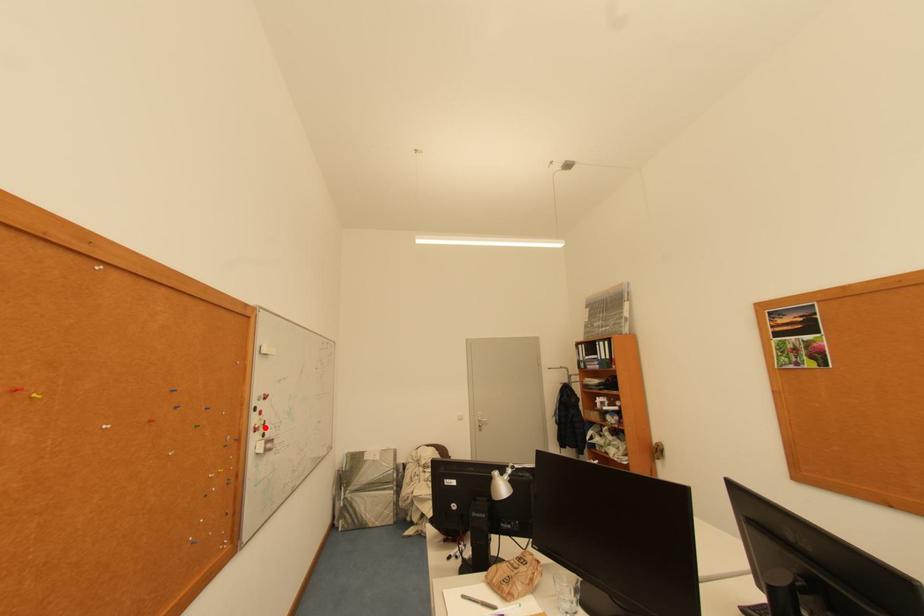
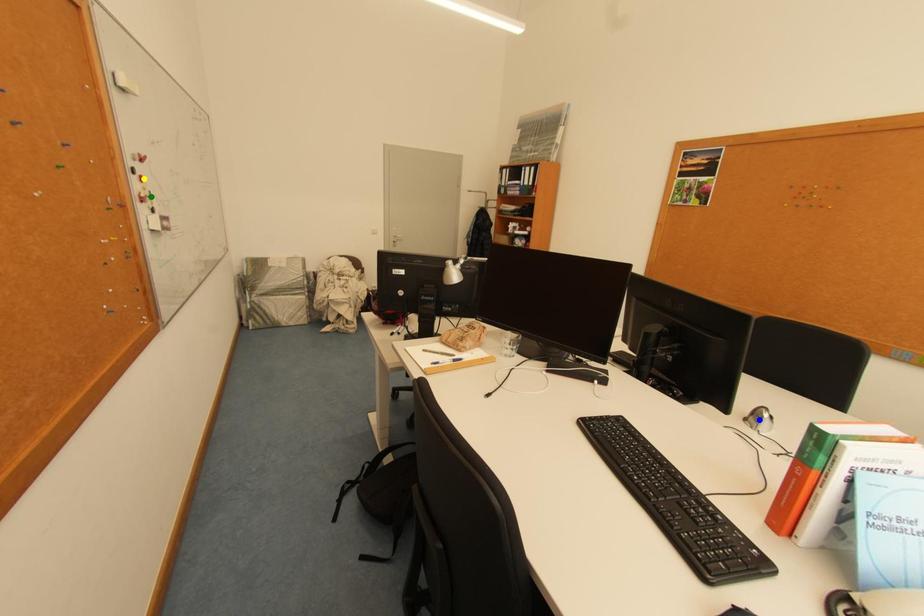
Question: I am providing you with two images of the same scene from different viewpoints. A red point is marked on the first image. You are given multiple points on the second image. Which mark in image 2 goes with the point in image 1?

Choices:
 (A) green point
 (B) yellow point
 (C) blue point

Answer: (A)